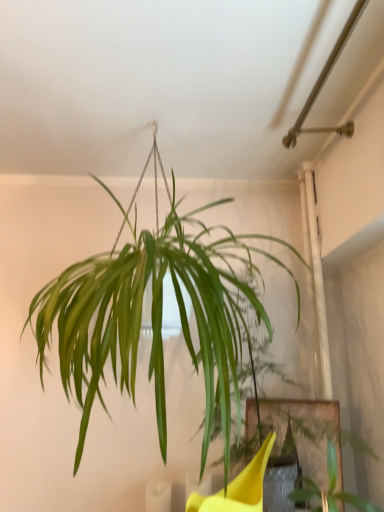
What is the approximate width of green leafy plant at lower right?

The width of green leafy plant at lower right is 8.44 inches.

Find the location of a particular element. Image resolution: width=384 pixels, height=512 pixels. green leafy plant at lower right is located at coordinates (330, 489).

The image size is (384, 512). What do you see at coordinates (330, 489) in the screenshot?
I see `green leafy plant at lower right` at bounding box center [330, 489].

This screenshot has width=384, height=512. I want to click on green leafy plant at center, so click(x=154, y=316).

What do you see at coordinates (154, 316) in the screenshot? I see `green leafy plant at center` at bounding box center [154, 316].

In order to face green leafy plant at center, should I rotate leftwards or rightwards?

To face it directly, rotate left by 3.821 degrees.

Locate an element on the screen. The width and height of the screenshot is (384, 512). green leafy plant at lower right is located at coordinates (330, 489).

Which object is positioned more to the left, green leafy plant at center or green leafy plant at lower right?

green leafy plant at center.

Does green leafy plant at center lie behind green leafy plant at lower right?

No, the depth of green leafy plant at center is less than that of green leafy plant at lower right.

From the picture: Which point is more forward, (68, 393) or (357, 503)?

The point (357, 503) is more forward.

From the image's perspective, is green leafy plant at center located beneath green leafy plant at lower right?

Incorrect, from the image's perspective, green leafy plant at center is higher than green leafy plant at lower right.

From a real-world perspective, does green leafy plant at center stand above green leafy plant at lower right?

Yes.

Does green leafy plant at center have a lesser width compared to green leafy plant at lower right?

Incorrect, the width of green leafy plant at center is not less than that of green leafy plant at lower right.

From their relative heights in the image, would you say green leafy plant at center is taller or shorter than green leafy plant at lower right?

Clearly, green leafy plant at center is taller compared to green leafy plant at lower right.

Considering the sizes of objects green leafy plant at center and green leafy plant at lower right in the image provided, who is smaller, green leafy plant at center or green leafy plant at lower right?

Smaller between the two is green leafy plant at lower right.

Would you say green leafy plant at lower right is part of green leafy plant at center's contents?

No, green leafy plant at lower right is not inside green leafy plant at center.

Is green leafy plant at center not near green leafy plant at lower right?

No, green leafy plant at center is in close proximity to green leafy plant at lower right.

Is green leafy plant at center facing towards green leafy plant at lower right?

No, green leafy plant at center is not facing towards green leafy plant at lower right.

What's the angular difference between green leafy plant at center and green leafy plant at lower right's facing directions?

1.02 degrees.

How much distance is there between green leafy plant at center and green leafy plant at lower right?

53.82 centimeters.

The height and width of the screenshot is (512, 384). In order to click on plant located behind the green leafy plant at center in this screenshot , I will do `click(330, 489)`.

Consider the image. Is green leafy plant at lower right at the left side of green leafy plant at center?

No.

Considering the relative positions of green leafy plant at lower right and green leafy plant at center in the image provided, is green leafy plant at lower right in front of green leafy plant at center?

No.

Which is in front, point (321, 508) or point (90, 382)?

The point (90, 382) is in front.

From the image's perspective, which one is positioned lower, green leafy plant at lower right or green leafy plant at center?

green leafy plant at lower right appears lower in the image.

From a real-world perspective, who is located lower, green leafy plant at lower right or green leafy plant at center?

green leafy plant at lower right is physically lower.

Does green leafy plant at lower right have a greater width compared to green leafy plant at center?

No, green leafy plant at lower right is not wider than green leafy plant at center.

Is green leafy plant at lower right shorter than green leafy plant at center?

Yes, green leafy plant at lower right is shorter than green leafy plant at center.

Who is smaller, green leafy plant at lower right or green leafy plant at center?

Smaller between the two is green leafy plant at lower right.

Would you say green leafy plant at lower right is inside or outside green leafy plant at center?

green leafy plant at lower right is not inside green leafy plant at center, it's outside.

Are green leafy plant at lower right and green leafy plant at center making contact?

green leafy plant at lower right and green leafy plant at center are not in contact.

Is green leafy plant at lower right oriented towards green leafy plant at center?

No, green leafy plant at lower right is not aimed at green leafy plant at center.

How far apart are green leafy plant at lower right and green leafy plant at center?

green leafy plant at lower right and green leafy plant at center are 21.19 inches apart from each other.

This screenshot has width=384, height=512. I want to click on plant below the green leafy plant at center (from the image's perspective), so click(x=330, y=489).

I want to click on plant located underneath the green leafy plant at center (from a real-world perspective), so click(x=330, y=489).

Find the location of a particular element. houseplant lying in front of the green leafy plant at lower right is located at coordinates (154, 316).